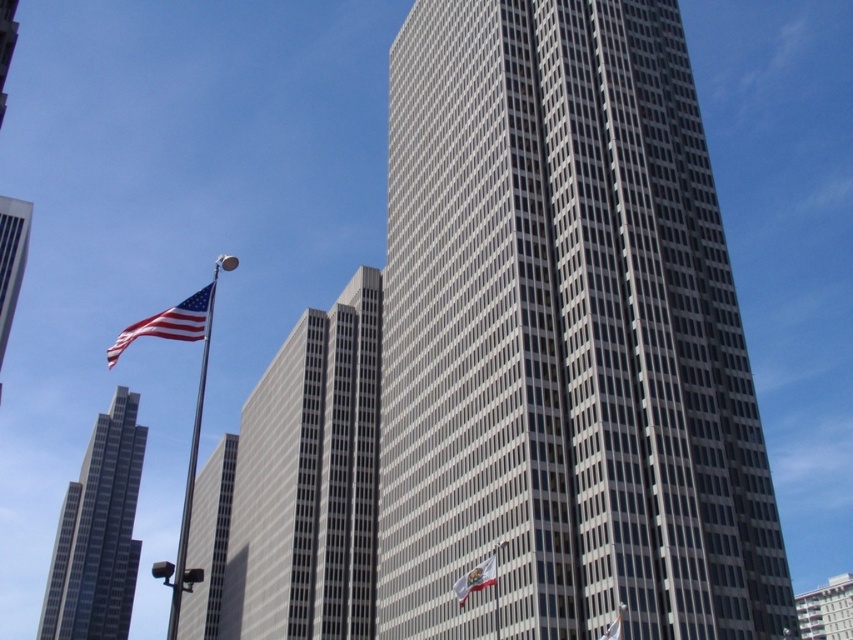
Can you confirm if gray/white glass skyscraper at center is shorter than silver metallic flag pole at left?

Correct, gray/white glass skyscraper at center is not as tall as silver metallic flag pole at left.

Is gray/white glass skyscraper at center bigger than silver metallic flag pole at left?

Incorrect, gray/white glass skyscraper at center is not larger than silver metallic flag pole at left.

Between point (461, 176) and point (201, 292), which one is positioned in front?

Point (201, 292) is more forward.

The image size is (853, 640). Identify the location of gray/white glass skyscraper at center. (564, 337).

Who is lower down, metallic silver air vent at left or white fabric flag at center?

white fabric flag at center is below.

Which is more to the left, metallic silver air vent at left or white fabric flag at center?

metallic silver air vent at left

Does point (3, 317) come in front of point (463, 592)?

No, (3, 317) is behind (463, 592).

I want to click on metallic silver air vent at left, so click(x=10, y=259).

Does smooth glass skyscraper at left have a larger size compared to matte fabric flag at left?

No, smooth glass skyscraper at left is not bigger than matte fabric flag at left.

Between smooth glass skyscraper at left and matte fabric flag at left, which one is positioned higher?

matte fabric flag at left

At what (x,y) coordinates should I click in order to perform the action: click on smooth glass skyscraper at left. Please return your answer as a coordinate pair (x, y). The height and width of the screenshot is (640, 853). Looking at the image, I should click on (97, 532).